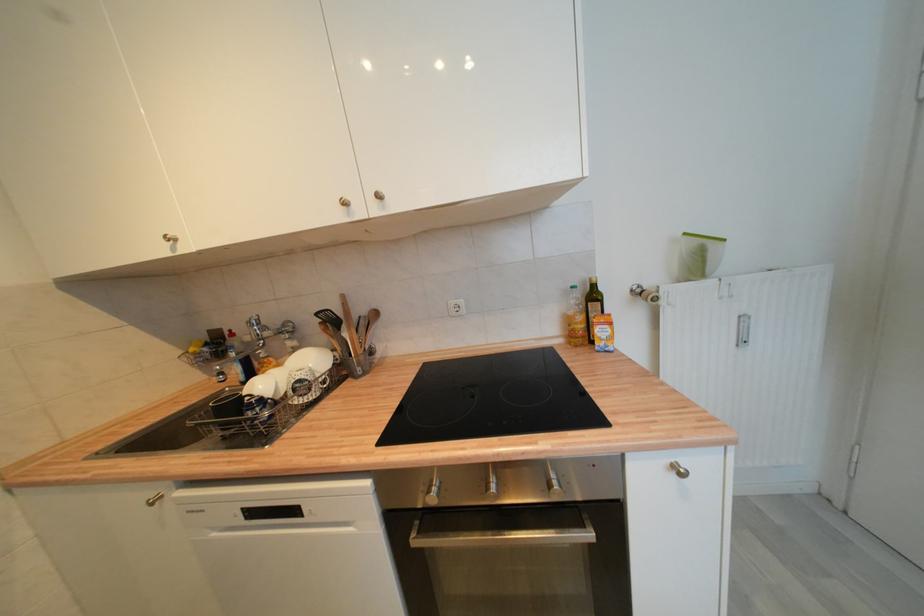
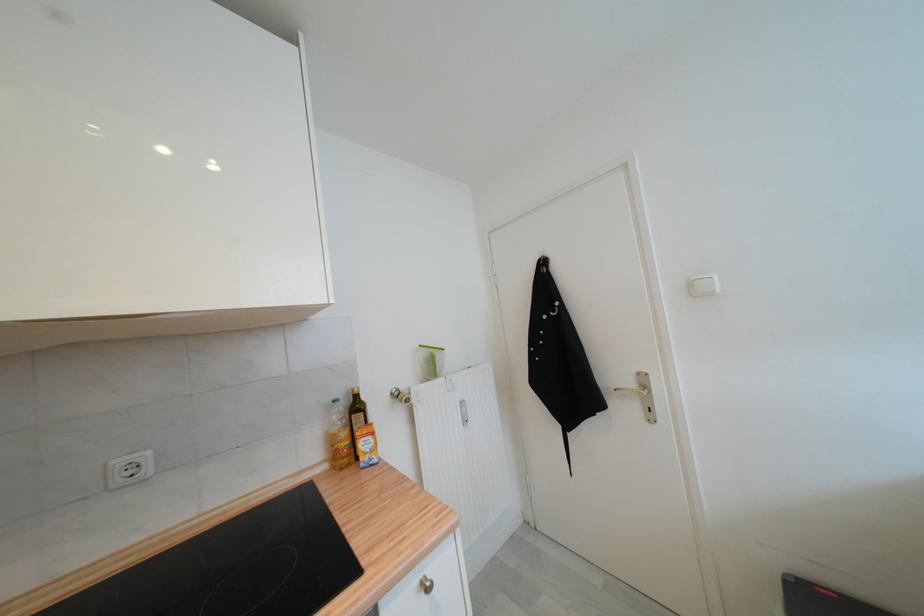
In the second image, find the point that corresponds to pixel 456 305 in the first image.

(126, 464)